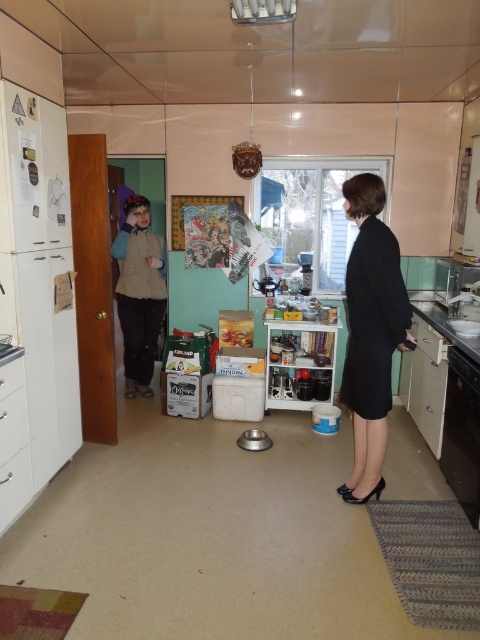
You are a GUI agent. You are given a task and a screenshot of the screen. Output one action in this format:
    pyautogui.click(x=<x>, y=<y>)
    Task: Click on the black fabric dress at right
    The image size is (480, 640).
    Given the screenshot: What is the action you would take?
    pyautogui.click(x=371, y=332)

Is black fabric dress at right above metallic stainless steel sink at right?

Incorrect, black fabric dress at right is not positioned above metallic stainless steel sink at right.

Is point (392, 289) positioned after point (443, 272)?

No.

Identify the location of black fabric dress at right. The image size is (480, 640). (371, 332).

Is point (137, 211) positioned after point (462, 278)?

Yes, point (137, 211) is behind point (462, 278).

This screenshot has height=640, width=480. What do you see at coordinates (140, 292) in the screenshot? I see `beige fabric vest at left` at bounding box center [140, 292].

Find the location of a particular element. The height and width of the screenshot is (640, 480). beige fabric vest at left is located at coordinates (140, 292).

Can you confirm if black fabric dress at right is positioned to the right of metallic silver exhaust hood at upper center?

Correct, you'll find black fabric dress at right to the right of metallic silver exhaust hood at upper center.

Does point (384, 198) come farther from viewer compared to point (295, 4)?

Yes, point (384, 198) is farther from viewer.

Identify the location of black fabric dress at right. This screenshot has height=640, width=480. (371, 332).